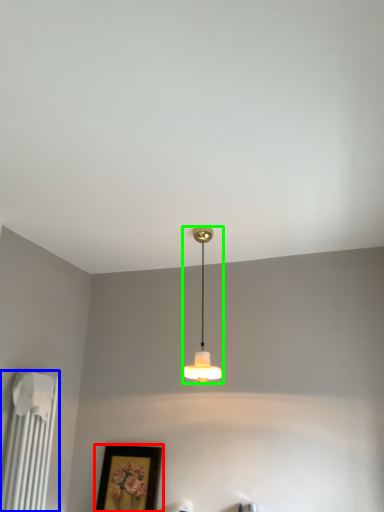
Question: Which object is positioned closest to picture frame (highlighted by a red box)? Select from radiator (highlighted by a blue box) and lamp (highlighted by a green box).

Choices:
 (A) radiator
 (B) lamp

Answer: (A)